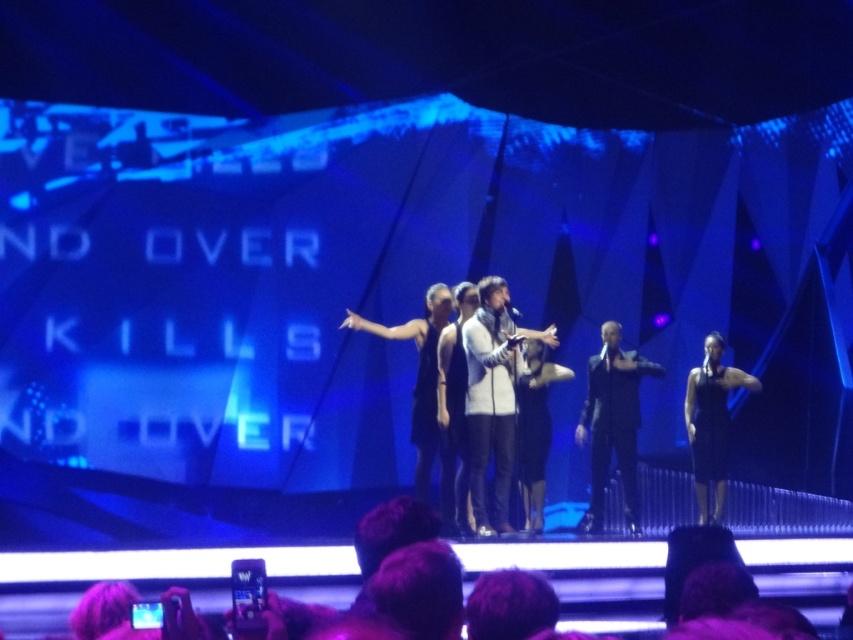
Based on the photo, you are a stagehand needing to place a 1.5 meter long banner between the black leather suit at center and the black satin dress at center. Can you fit the banner between them?

The distance between the black leather suit at center and the black satin dress at center is 1.09 meters, so the banner cannot be placed between them since it is longer than the available space.

You are a photographer taking a picture of the stage performance. You notice two points marked as point 1 and point 2 on your camera screen. Point 1 is at coordinates point (631, 372) and Point 2 is at point (688, 378). If you want to focus on the closer point to the audience, which point should you choose?

Point 1 is closer to the viewer than point 2, so you should focus on point 1.

You are a stagehand preparing to place a new spotlight on the stage. The spotlight has a 1.2 meter diameter coverage area. You need to decide whether to aim it at the black leather suit at center or the black satin dress at center so that the entire spotlight covers the target without overlapping other performers. Based on their widths, which one should you choose?

The black leather suit at center might be wider than black satin dress at center, so to ensure the spotlight covers the entire target without overlapping, the black leather suit at center would require the spotlight since it is wider and needs more coverage area.